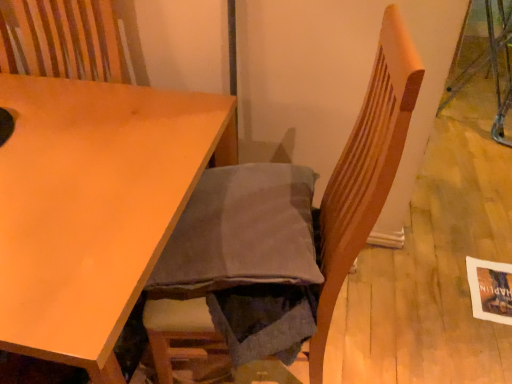
Question: Considering the relative positions of wooden chair at center and matte wood table at center in the image provided, is wooden chair at center to the left of matte wood table at center from the viewer's perspective?

Choices:
 (A) no
 (B) yes

Answer: (A)

Question: Is wooden chair at center facing away from matte wood table at center?

Choices:
 (A) yes
 (B) no

Answer: (B)

Question: Can you confirm if wooden chair at center is thinner than matte wood table at center?

Choices:
 (A) no
 (B) yes

Answer: (B)

Question: From the image's perspective, is wooden chair at center over matte wood table at center?

Choices:
 (A) yes
 (B) no

Answer: (A)

Question: Considering the relative sizes of wooden chair at center and matte wood table at center in the image provided, is wooden chair at center smaller than matte wood table at center?

Choices:
 (A) yes
 (B) no

Answer: (A)

Question: Does wooden chair at center have a greater height compared to matte wood table at center?

Choices:
 (A) yes
 (B) no

Answer: (A)

Question: Is matte wood table at center not within wooden chair at center?

Choices:
 (A) yes
 (B) no

Answer: (A)

Question: Is matte wood table at center directly adjacent to wooden chair at center?

Choices:
 (A) no
 (B) yes

Answer: (A)

Question: Is matte wood table at center oriented towards wooden chair at center?

Choices:
 (A) yes
 (B) no

Answer: (B)

Question: Considering the relative sizes of matte wood table at center and wooden chair at center in the image provided, is matte wood table at center taller than wooden chair at center?

Choices:
 (A) yes
 (B) no

Answer: (B)

Question: Does matte wood table at center have a lesser width compared to wooden chair at center?

Choices:
 (A) yes
 (B) no

Answer: (B)

Question: Are matte wood table at center and wooden chair at center located far from each other?

Choices:
 (A) yes
 (B) no

Answer: (B)

Question: Relative to matte wood table at center, is wooden chair at center in front or behind?

Choices:
 (A) behind
 (B) front

Answer: (B)